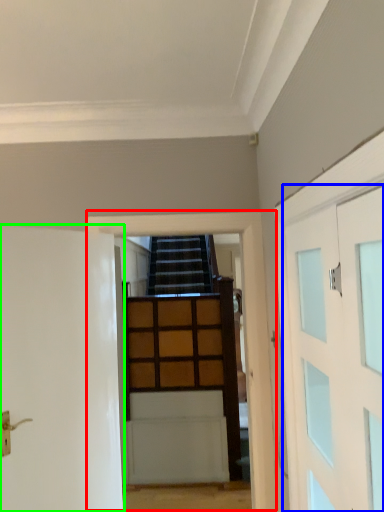
Question: Which object is positioned farthest from garage door (highlighted by a red box)? Select from door (highlighted by a blue box) and door (highlighted by a green box).

Choices:
 (A) door
 (B) door

Answer: (A)